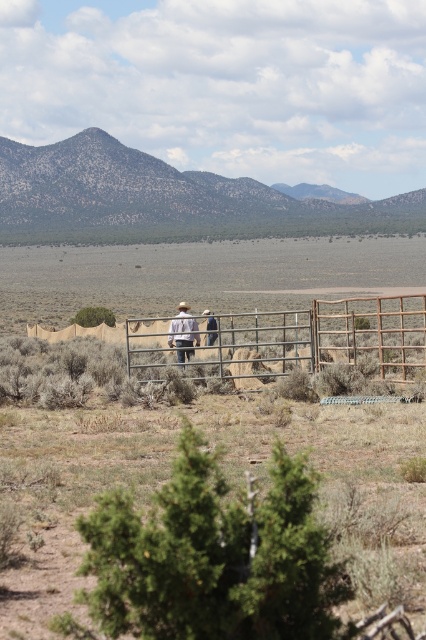
You are a hiker trying to pass through the open gate in the image. You have a light brown leather jacket at center. Can your jacket fit through the spaces between the bars of the metallic wire fence at center without getting caught?

The metallic wire fence at center is wider than the light brown leather jacket at center, so the jacket can fit through the spaces between the bars without getting caught.

You are standing in the arid landscape depicted in the image and want to walk towards the metal gate. There are two points marked in the scene, point (x=233, y=356) and point (x=207, y=337). Which point should you head towards to get closer to the gate?

You should head towards point (x=233, y=356) because it is closer to the camera, meaning it is nearer to your current position and thus closer to the gate.